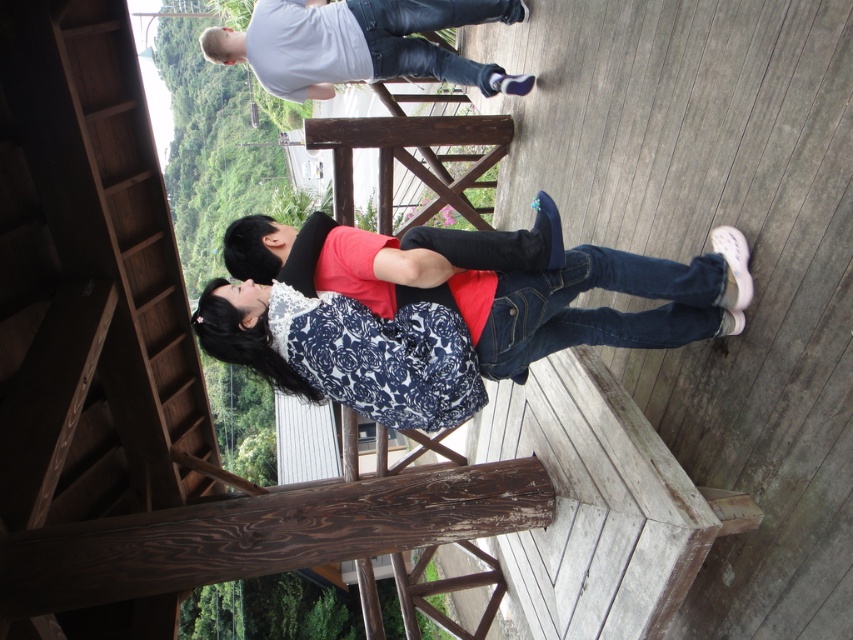
Who is lower down, floral-patterned sweater at center or white matte shirt at upper center?

floral-patterned sweater at center

Can you confirm if floral-patterned sweater at center is positioned above white matte shirt at upper center?

Incorrect, floral-patterned sweater at center is not positioned above white matte shirt at upper center.

Find the location of a particular element. floral-patterned sweater at center is located at coordinates (451, 312).